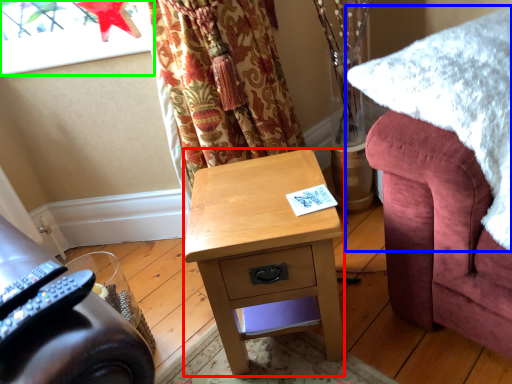
Question: Estimate the real-world distances between objects in this image. Which object is farther from desk (highlighted by a red box), blanket (highlighted by a blue box) or window screen (highlighted by a green box)?

Choices:
 (A) blanket
 (B) window screen

Answer: (B)